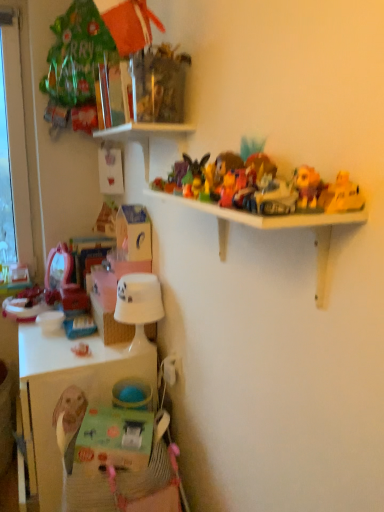
Identify the location of free location in front of matte pink toy at lower left, the 1th toy positioned from the back. (67, 365).